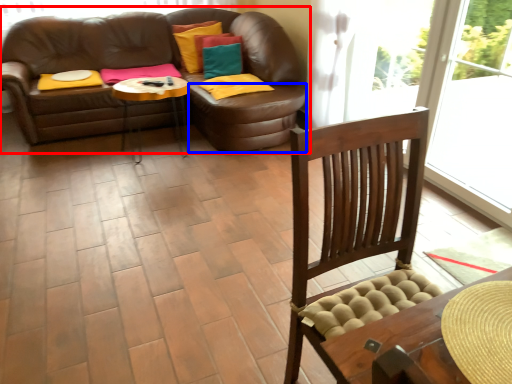
Question: Which of the following is the closest to the observer, studio couch (highlighted by a red box) or footrest (highlighted by a blue box)?

Choices:
 (A) studio couch
 (B) footrest

Answer: (B)